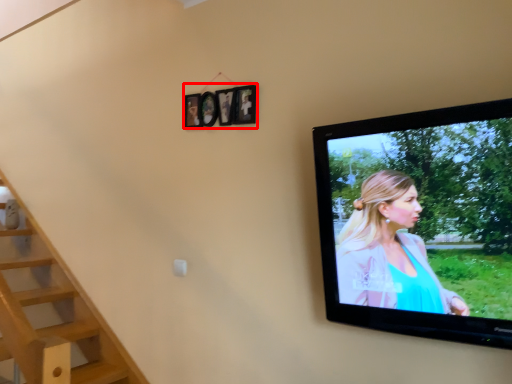
Question: In this image, where is picture frame (annotated by the red box) located relative to television?

Choices:
 (A) left
 (B) right

Answer: (A)